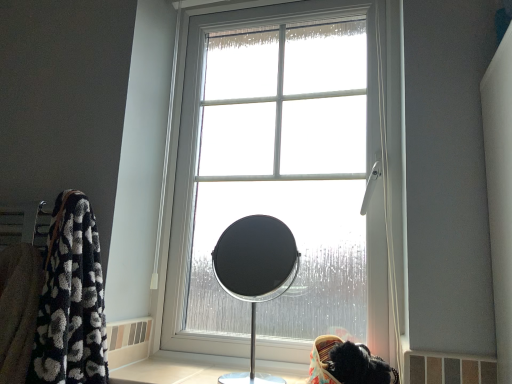
Question: In the image, is matte black mirror at center on the left side or the right side of clear glass window at center?

Choices:
 (A) right
 (B) left

Answer: (B)

Question: Is matte black mirror at center inside the boundaries of clear glass window at center, or outside?

Choices:
 (A) inside
 (B) outside

Answer: (B)

Question: In the image, is matte black mirror at center positioned in front of or behind clear glass window at center?

Choices:
 (A) behind
 (B) front

Answer: (B)

Question: Is point (214, 28) closer or farther from the camera than point (245, 273)?

Choices:
 (A) closer
 (B) farther

Answer: (A)

Question: In terms of height, does clear glass window at center look taller or shorter compared to matte black mirror at center?

Choices:
 (A) tall
 (B) short

Answer: (A)

Question: Is clear glass window at center to the left or to the right of matte black mirror at center in the image?

Choices:
 (A) right
 (B) left

Answer: (A)

Question: Relative to matte black mirror at center, is clear glass window at center in front or behind?

Choices:
 (A) front
 (B) behind

Answer: (B)